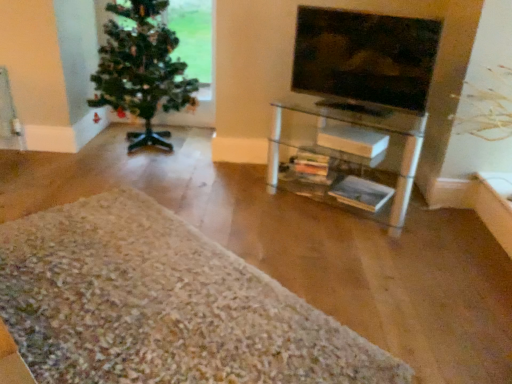
What are the coordinates of `free space that is in between clear glass shelf at center and white shaggy rug at lower left` in the screenshot? It's located at click(304, 238).